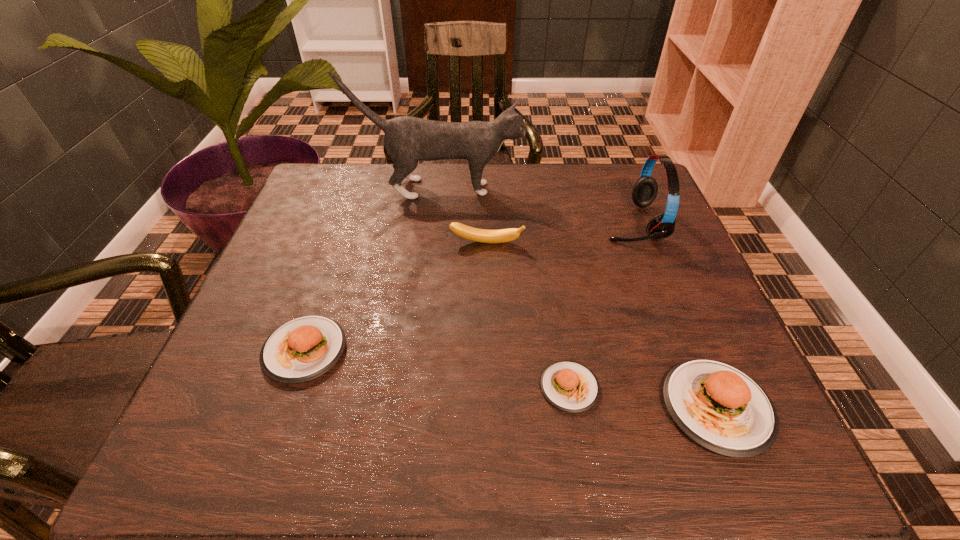
To achieve even spacing by inserting another patty_(food) among them, please point to a vacant spot for this new patty_(food). Please provide its 2D coordinates. Your answer should be formatted as a tuple, i.e. [(x, y)], where the tuple contains the x and y coordinates of a point satisfying the conditions above.

[(433, 368)]